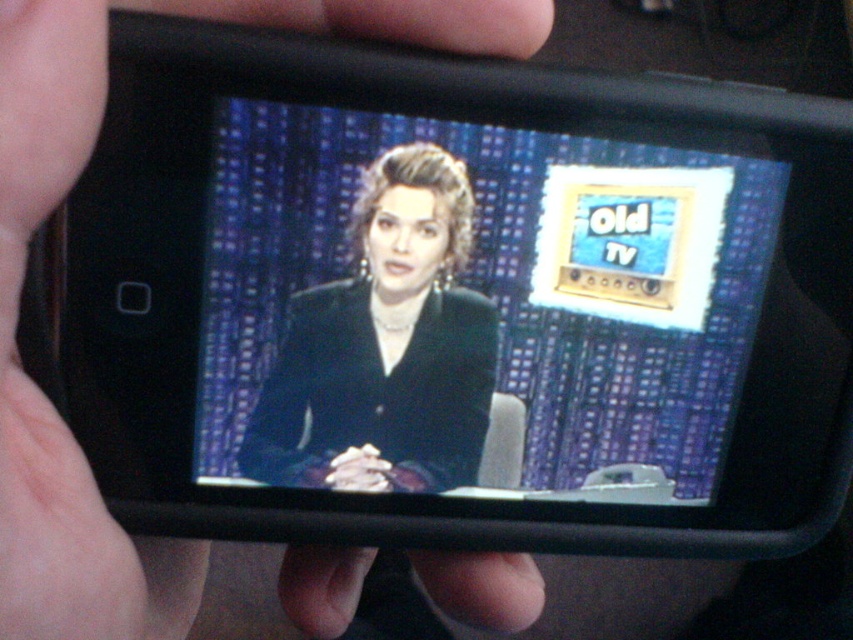
From the picture: You are looking at the smartphone screen and notice two points marked on it. The first point is at coordinates point (326,428) and the second is at point (4,630). Which point is closer to you on the screen?

Point (326,428) is further to the viewer than point (4,630), so the second point is closer to you.

You are a photographer trying to capture a closeup shot of the shiny black screen at center and the black matte skin at upper left. Which object should you focus on first if you want to ensure both are in focus without moving the camera?

You should focus on the shiny black screen at center first because it is closer to the camera than the black matte skin at upper left, so focusing on it will keep both in focus.

You are designing a poster for a movie and need to highlight both the shiny black screen at center and the black velvet suit at center. Which object should you make larger to emphasize its importance?

The shiny black screen at center should be made larger since it is bigger than the black velvet suit at center in the original image, making it a focal point.